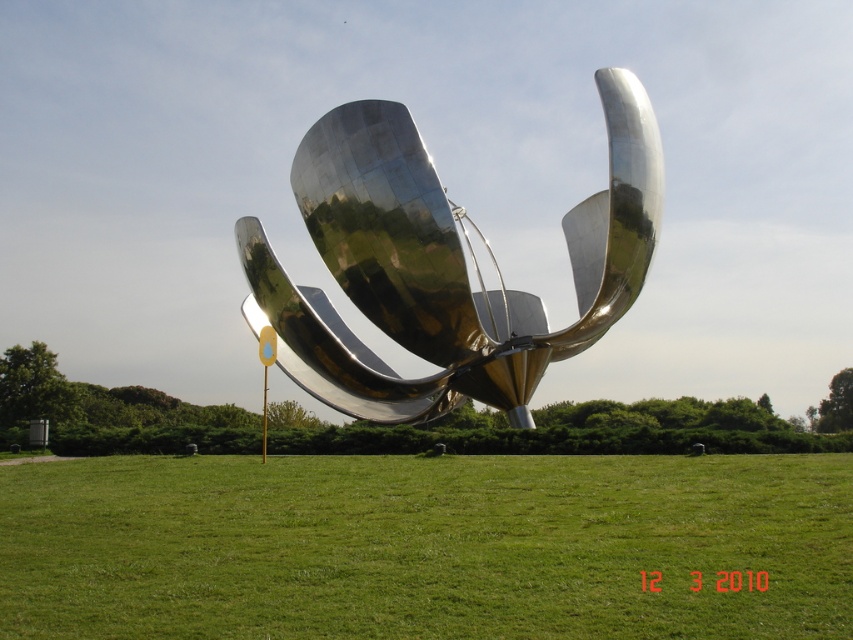
You are standing at the base of the metallic sculpture and want to walk towards the point labeled point (x=692, y=584). As you move forward, will you pass by point (x=486, y=400) before reaching your destination?

Point (x=692, y=584) is in front of point (x=486, y=400), so you will reach point (x=692, y=584) before passing point (x=486, y=400). Therefore, you will not pass by point (x=486, y=400) before reaching your destination.

You are standing at the base of the metallic sculpture in the grassy area. Looking around, you notice a point marked at coordinates (x=426, y=547). What is located at that point?

The point at coordinates (x=426, y=547) indicates green grass at center.

You are an artist planning to paint this scene. You want to ensure the green grass at center and the shiny metallic flower at center are proportionally accurate. Which object should you paint larger to maintain the correct proportions?

The shiny metallic flower at center should be painted larger than the green grass at center because the green grass at center occupies less space than the shiny metallic flower at center.